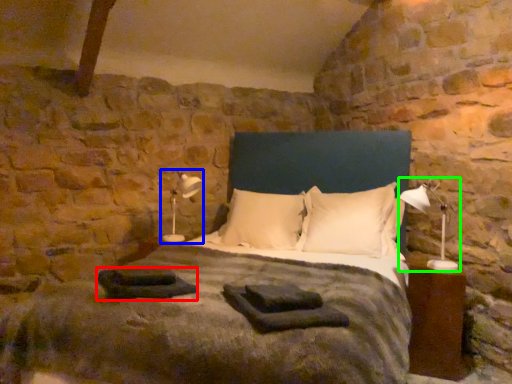
Question: Considering the real-world distances, which object is closest to material (highlighted by a red box)? table lamp (highlighted by a blue box) or table lamp (highlighted by a green box).

Choices:
 (A) table lamp
 (B) table lamp

Answer: (A)